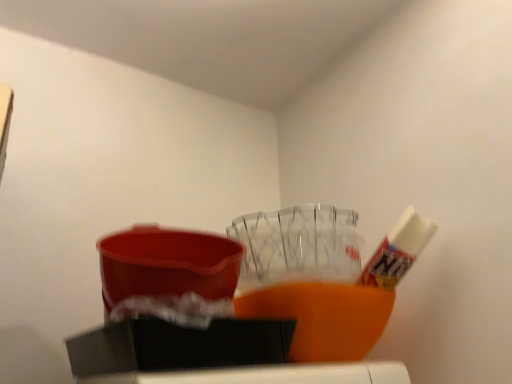
Question: Is white glossy tube at upper right wider or thinner than matte plastic basin at center?

Choices:
 (A) thin
 (B) wide

Answer: (A)

Question: Considering the positions of white glossy tube at upper right and matte plastic basin at center in the image, is white glossy tube at upper right taller or shorter than matte plastic basin at center?

Choices:
 (A) short
 (B) tall

Answer: (B)

Question: From a real-world perspective, is white glossy tube at upper right physically located above or below matte plastic basin at center?

Choices:
 (A) above
 (B) below

Answer: (A)

Question: Would you say matte plastic basin at center is inside or outside white glossy tube at upper right?

Choices:
 (A) outside
 (B) inside

Answer: (A)

Question: Is matte plastic basin at center in front of or behind white glossy tube at upper right in the image?

Choices:
 (A) front
 (B) behind

Answer: (A)

Question: Is matte plastic basin at center bigger or smaller than white glossy tube at upper right?

Choices:
 (A) small
 (B) big

Answer: (B)

Question: Considering the relative positions of matte plastic basin at center and white glossy tube at upper right in the image provided, is matte plastic basin at center to the left or to the right of white glossy tube at upper right?

Choices:
 (A) left
 (B) right

Answer: (A)